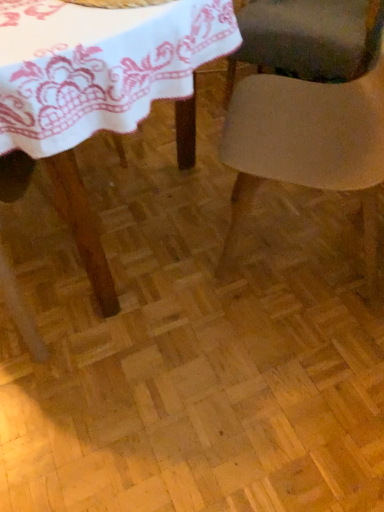
The width and height of the screenshot is (384, 512). I want to click on free space underneath smooth beige chair at center, which appears as the second chair when viewed from the back (from a real-world perspective), so click(x=300, y=241).